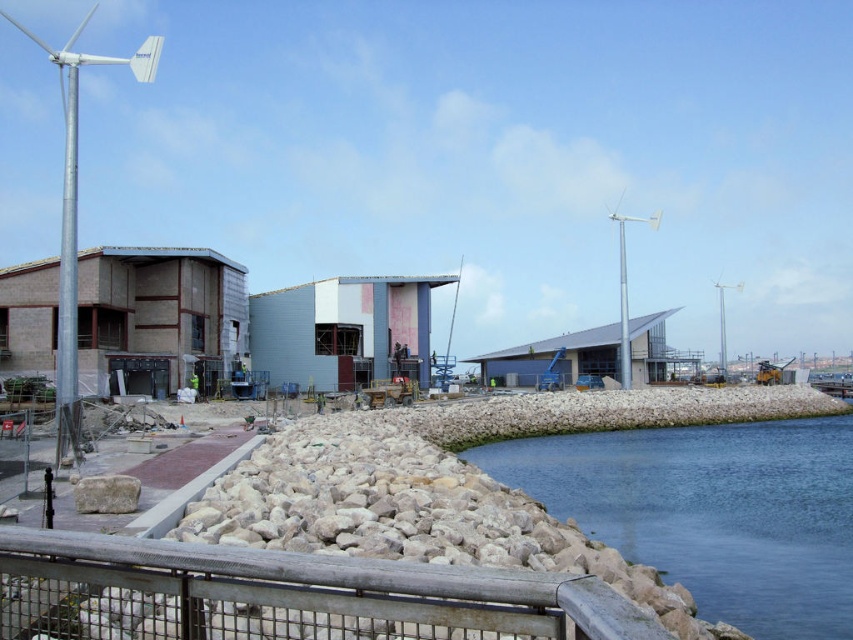
Who is higher up, blue smooth water at lower right or silver metallic wind turbine at left?

silver metallic wind turbine at left is higher up.

You are a GUI agent. You are given a task and a screenshot of the screen. Output one action in this format:
    pyautogui.click(x=<x>, y=<y>)
    Task: Click on the blue smooth water at lower right
    The image size is (853, 640).
    Given the screenshot: What is the action you would take?
    pyautogui.click(x=712, y=512)

Who is positioned more to the right, blue smooth water at lower right or rustic wood rail at lower center?

blue smooth water at lower right is more to the right.

Is point (712, 566) more distant than point (141, 576)?

Yes.

Describe the element at coordinates (712, 512) in the screenshot. I see `blue smooth water at lower right` at that location.

The image size is (853, 640). I want to click on blue smooth water at lower right, so click(x=712, y=512).

Does rustic wood rail at lower center appear on the right side of silver metallic wind turbine at left?

Yes, rustic wood rail at lower center is to the right of silver metallic wind turbine at left.

Which is more to the left, rustic wood rail at lower center or silver metallic wind turbine at left?

silver metallic wind turbine at left is more to the left.

Where is `rustic wood rail at lower center`? The height and width of the screenshot is (640, 853). rustic wood rail at lower center is located at coordinates (288, 595).